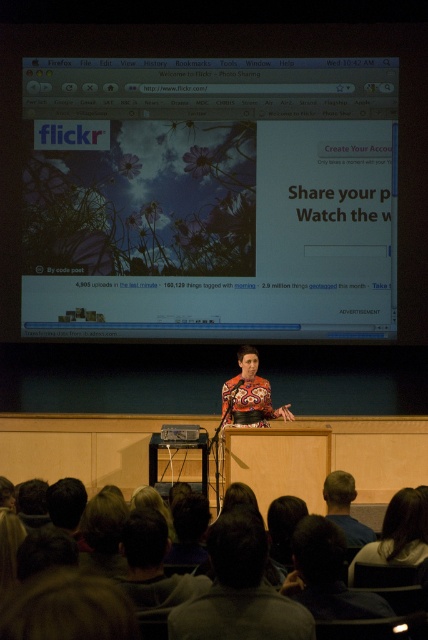
Between dark gray hair at lower center and printed fabric dress at center, which one has more height?

Standing taller between the two is printed fabric dress at center.

Consider the image. Is dark gray hair at lower center further to camera compared to printed fabric dress at center?

No, dark gray hair at lower center is closer to the viewer.

Who is more distant from viewer, (272, 636) or (240, 401)?

The point (240, 401) is behind.

Where is `dark gray hair at lower center`? dark gray hair at lower center is located at coordinates (240, 589).

Between dark brown hair at lower right and blue shirt at lower right, which one appears on the left side from the viewer's perspective?

Positioned to the left is blue shirt at lower right.

Can you confirm if dark brown hair at lower right is positioned to the left of blue shirt at lower right?

Incorrect, dark brown hair at lower right is not on the left side of blue shirt at lower right.

This screenshot has width=428, height=640. Identify the location of dark brown hair at lower right. (398, 532).

Image resolution: width=428 pixels, height=640 pixels. I want to click on dark brown hair at lower right, so click(x=398, y=532).

Is dark gray hair at lower center above metallic projector at center?

Correct, dark gray hair at lower center is located above metallic projector at center.

Can you confirm if dark gray hair at lower center is thinner than metallic projector at center?

No, dark gray hair at lower center is not thinner than metallic projector at center.

In order to click on dark gray hair at lower center in this screenshot , I will do `click(240, 589)`.